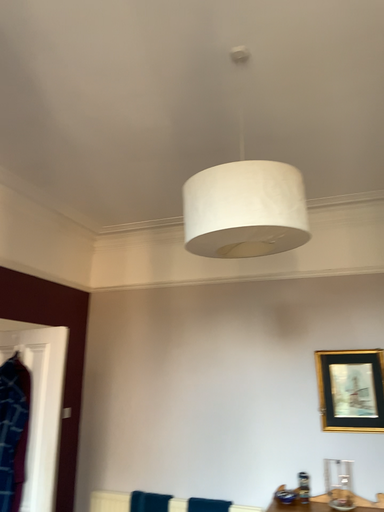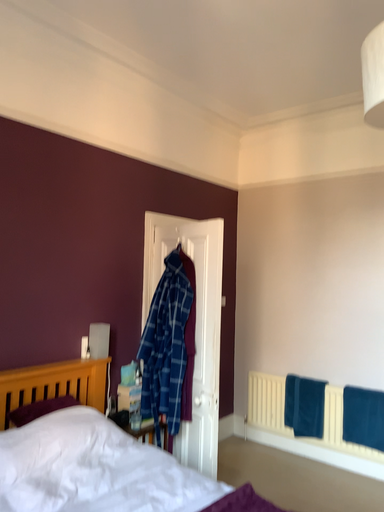
Question: How did the camera likely rotate when shooting the video?

Choices:
 (A) rotated upward
 (B) rotated downward

Answer: (B)